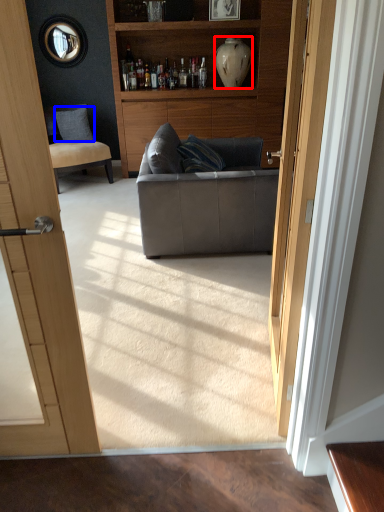
Question: Which object is further to the camera taking this photo, vase (highlighted by a red box) or pillow (highlighted by a blue box)?

Choices:
 (A) vase
 (B) pillow

Answer: (B)